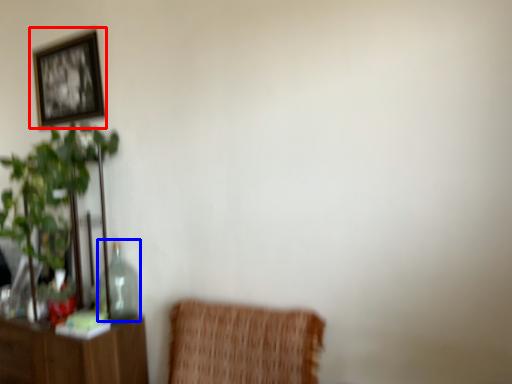
Question: Among these objects, which one is nearest to the camera, picture frame (highlighted by a red box) or glass vase (highlighted by a blue box)?

Choices:
 (A) picture frame
 (B) glass vase

Answer: (B)